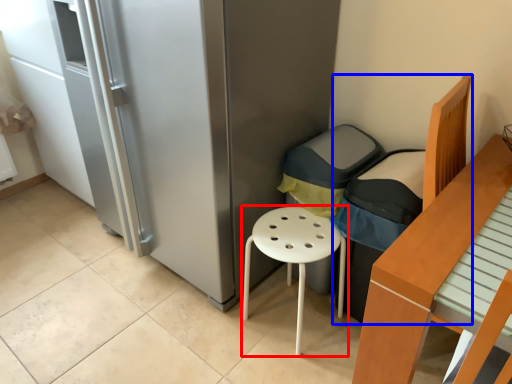
Question: Which point is closer to the camera, stool (highlighted by a red box) or armchair (highlighted by a blue box)?

Choices:
 (A) stool
 (B) armchair

Answer: (B)